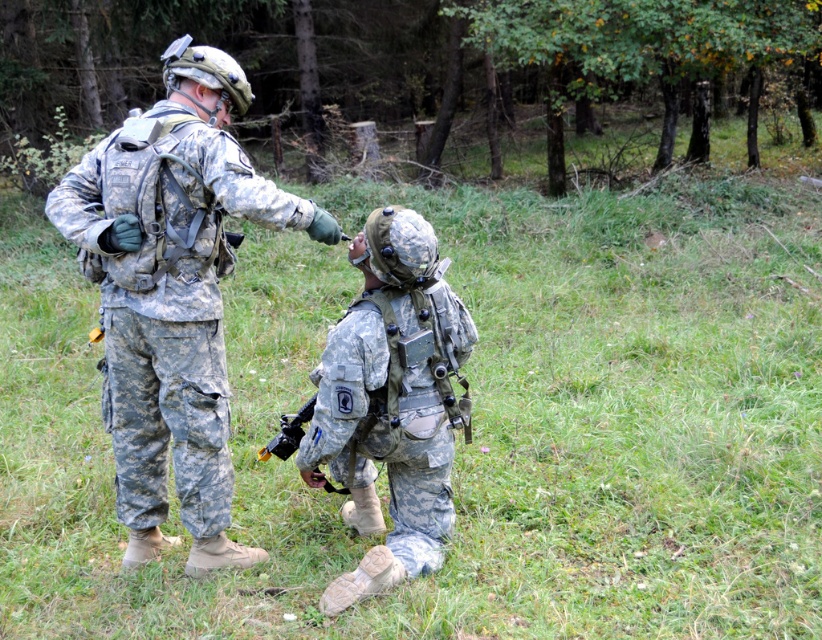
Which of these two, camouflage fabric uniform at center or camouflage fabric helmet at center, stands shorter?

With less height is camouflage fabric helmet at center.

Is point (284, 209) closer to camera compared to point (367, 570)?

Yes, it is in front of point (367, 570).

What are the coordinates of `camouflage fabric uniform at center` in the screenshot? It's located at (172, 294).

Does camouflage fabric uniform at center have a greater width compared to matte black rifle at lower center?

Yes.

Does camouflage fabric uniform at center appear on the right side of matte black rifle at lower center?

In fact, camouflage fabric uniform at center is to the left of matte black rifle at lower center.

Find the location of a particular element. This screenshot has height=640, width=822. camouflage fabric uniform at center is located at coordinates (172, 294).

Where is `camouflage fabric uniform at center`? camouflage fabric uniform at center is located at coordinates (172, 294).

Does camouflage fabric helmet at center have a lesser width compared to matte black rifle at lower center?

Incorrect, camouflage fabric helmet at center's width is not less than matte black rifle at lower center's.

Is camouflage fabric helmet at center below matte black rifle at lower center?

Incorrect, camouflage fabric helmet at center is not positioned below matte black rifle at lower center.

Locate an element on the screen. The height and width of the screenshot is (640, 822). camouflage fabric helmet at center is located at coordinates (390, 403).